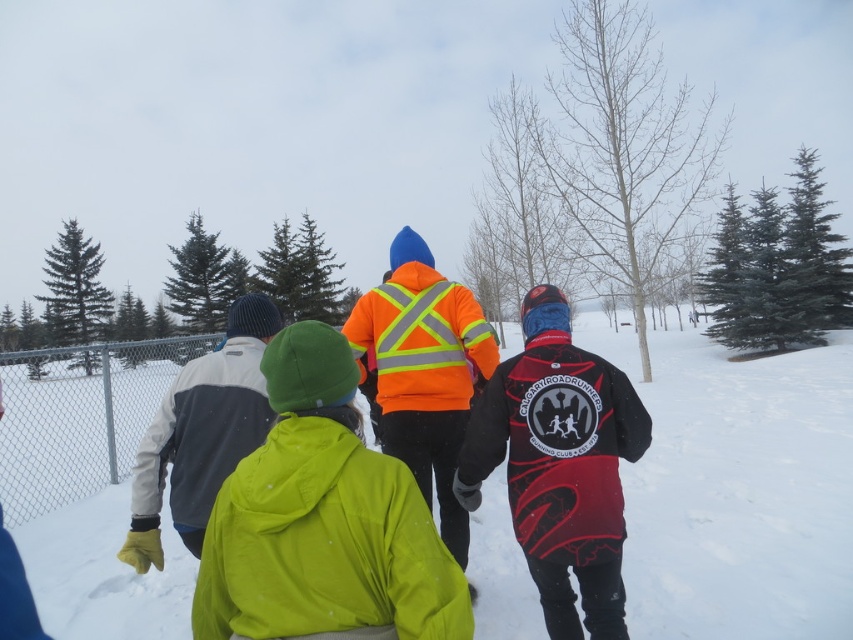
Question: Is the position of white fluffy snow at center less distant than that of silver chain-link fence at left?

Choices:
 (A) yes
 (B) no

Answer: (A)

Question: Is white fluffy snow at center to the left of neon green jacket at center from the viewer's perspective?

Choices:
 (A) yes
 (B) no

Answer: (B)

Question: Which is farther from the red matte jacket at center?

Choices:
 (A) white fluffy snow at center
 (B) high-visibility orange jacket at center

Answer: (A)

Question: Which of these objects is positioned closest to the neon green jacket at center?

Choices:
 (A) white fluffy snow at center
 (B) red matte jacket at center
 (C) silver chain-link fence at left

Answer: (B)

Question: Can you confirm if high-visibility orange jacket at center is positioned below silver chain-link fence at left?

Choices:
 (A) yes
 (B) no

Answer: (B)

Question: Which object is closer to the camera taking this photo?

Choices:
 (A) high-visibility orange jacket at center
 (B) silver chain-link fence at left
 (C) neon green jacket at center

Answer: (C)